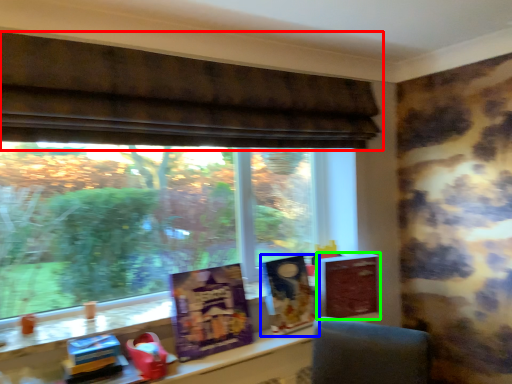
Question: Which object is the closest to the window (highlighted by a red box)? Choose among these: book cover (highlighted by a blue box) or paperback book (highlighted by a green box).

Choices:
 (A) book cover
 (B) paperback book

Answer: (A)